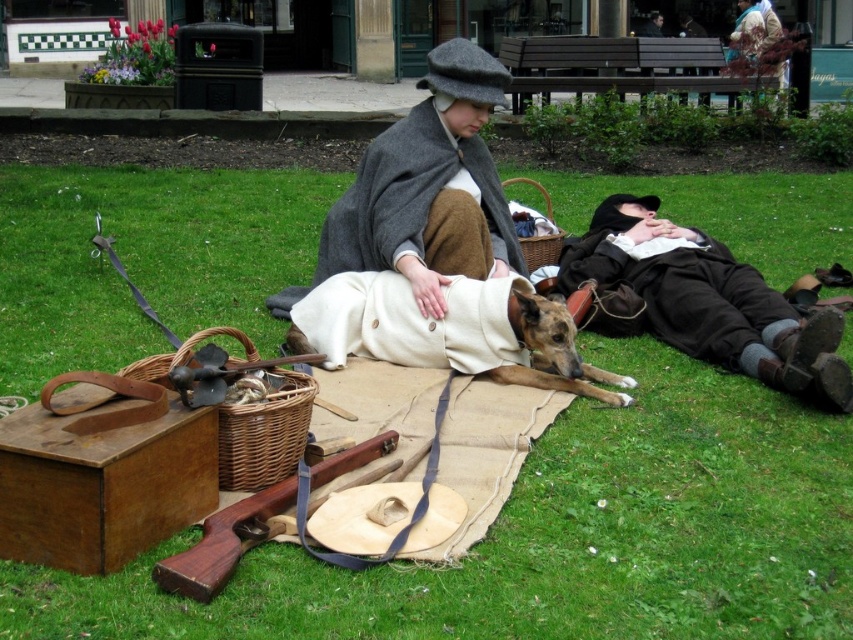
Based on the photo, you are planning to set up a picnic in the park. You have a green grass at center and a woven brown picnic basket at lower left. Which location should you choose to place the picnic basket so that it is closer to the grass?

The woven brown picnic basket at lower left should be placed to the left of the green grass at center to be closer to it, as the green grass at center is already positioned to the left of the woven brown picnic basket at lower left.

You are a photographer setting up a tripod in the park. You need to position it so that both the white woolen coat at center and the woven brown picnic basket at lower left are visible. Given their positions, where should you place the tripod to ensure both objects are in frame?

Place the tripod above the woven brown picnic basket at lower left so that the white woolen coat at center is visible above it, ensuring both are in frame.

You are standing in the park and see the point marked at coordinates (x=410, y=196). What object is located exactly at that point?

The point at coordinates (x=410, y=196) indicates the gray woolen cape at center.